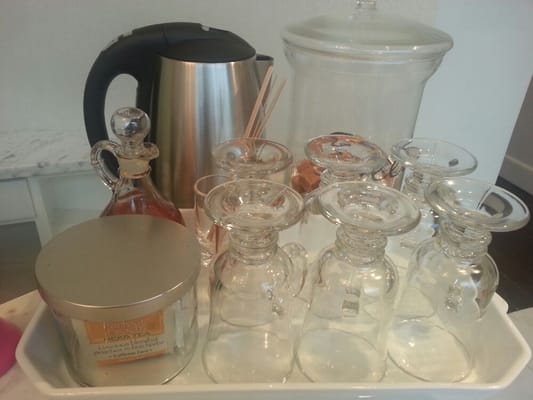
Locate an element on the screen. This screenshot has width=533, height=400. tall glass container is located at coordinates (357, 98).